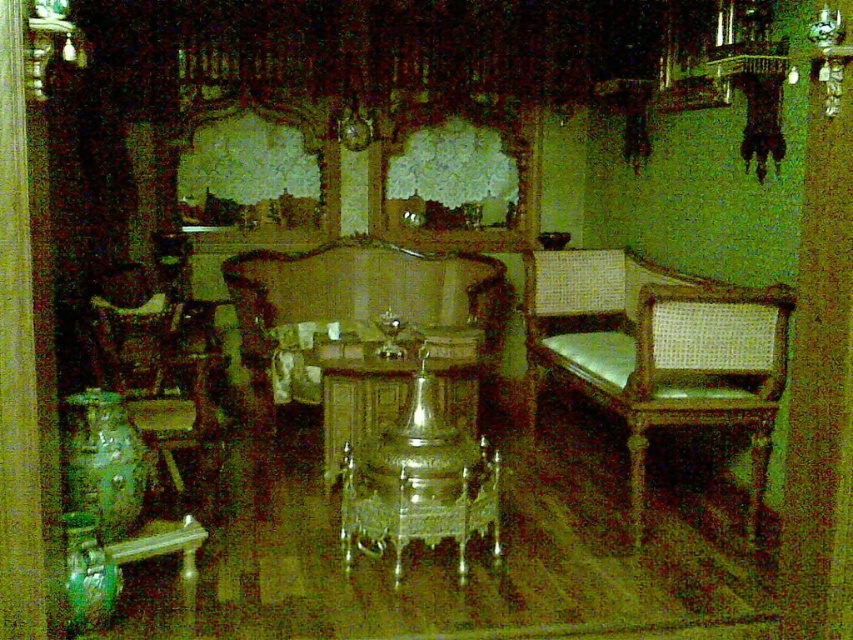
You are arranging a small tea set on the table between the woven wood armchair at right and the wooden armchair at left. Which chair has more space between it and the table for placing the tea set?

The woven wood armchair at right has more space between it and the table because its width is larger than the wooden armchair at left, creating a wider gap.

You are a guest in this room and want to sit down. You see the wooden polished table at center and the wooden armchair at left. Which one is closer to the entrance of the room?

The wooden armchair at left is closer to the entrance of the room because the wooden polished table at center is positioned on the right side of the wooden armchair at left, implying the armchair is nearer to the entrance.